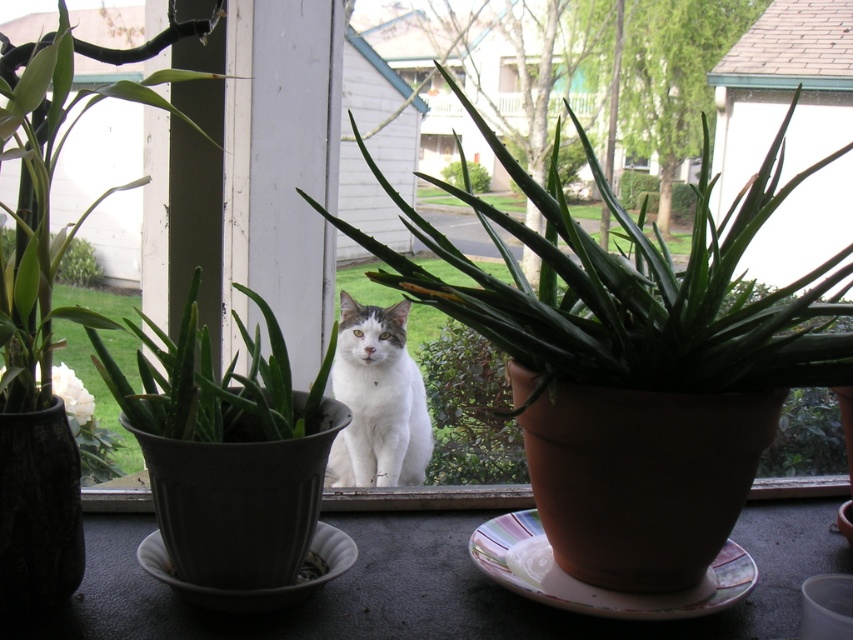
You are a photographer trying to capture the green matte aloe vera at center in focus. The camera can only focus on objects within 50 centimeters. Will the aloe vera be in focus?

The green matte aloe vera at center is 48.56 centimeters away from the viewer, which is within the camera focus range of 50 centimeters. Therefore, the aloe vera will be in focus.

You are a gardener who wants to rearrange the plants on the windowsill. The green matte plant at left and the green leafy plant at center are both in your way. Which plant should you move first to make space?

The green leafy plant at center should be moved first because the green matte plant at left is bigger and might be harder to move.